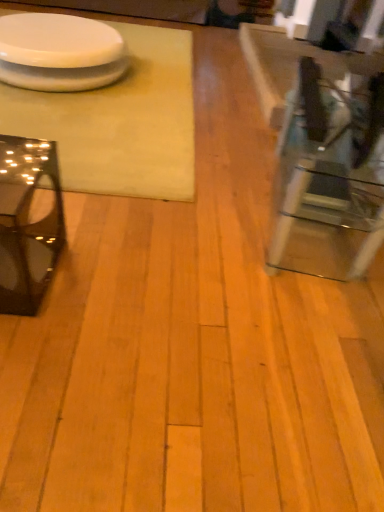
Where is `empty space that is ontop of white matte table at upper left, acting as the first table starting from the left (from a real-world perspective)`? empty space that is ontop of white matte table at upper left, acting as the first table starting from the left (from a real-world perspective) is located at coordinates (99, 98).